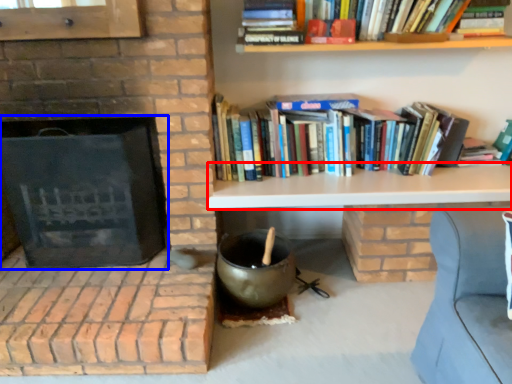
Question: Which point is closer to the camera, table (highlighted by a red box) or fireplace (highlighted by a blue box)?

Choices:
 (A) table
 (B) fireplace

Answer: (B)